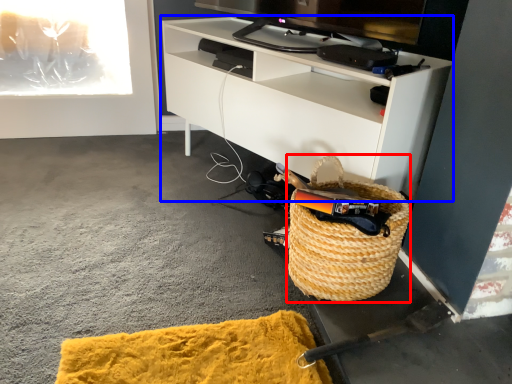
Question: Which object is closer to the camera taking this photo, picnic basket (highlighted by a red box) or cabinetry (highlighted by a blue box)?

Choices:
 (A) picnic basket
 (B) cabinetry

Answer: (A)